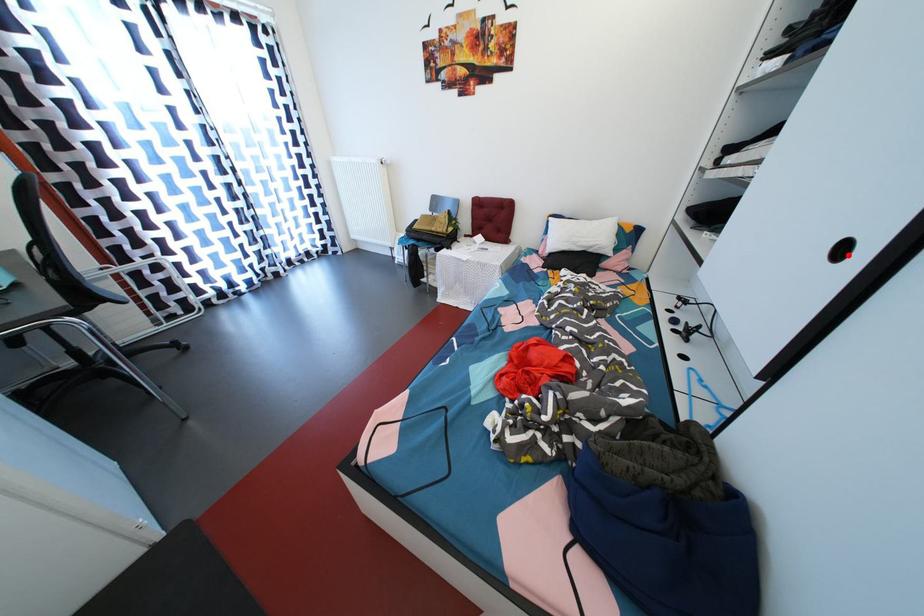
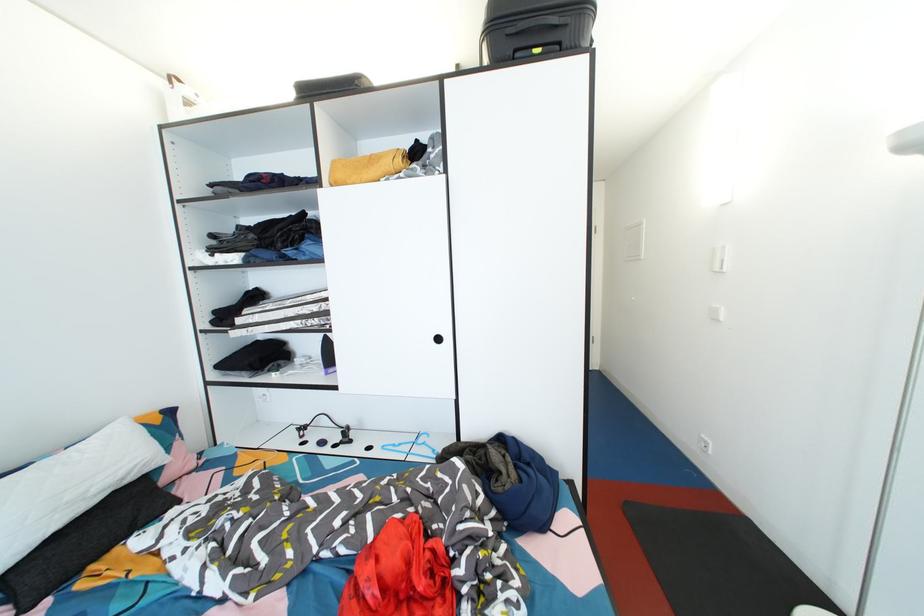
The point at the highlighted location is marked in the first image. Where is the corresponding point in the second image?

(444, 344)